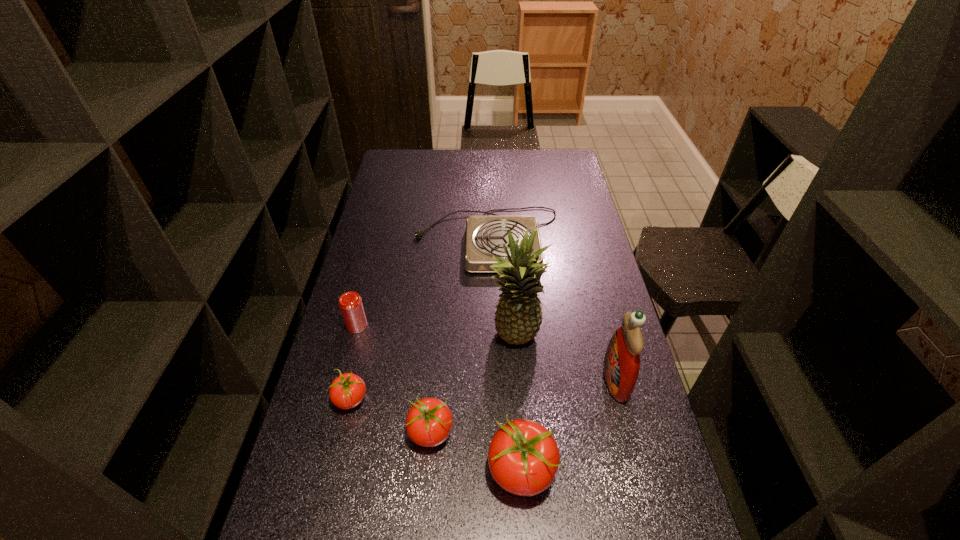
The image size is (960, 540). Find the location of `the shortest tomato`. the shortest tomato is located at coordinates (347, 391).

Image resolution: width=960 pixels, height=540 pixels. I want to click on the leftmost tomato, so click(347, 391).

I want to click on the second shortest tomato, so click(x=429, y=421).

Where is `the tallest tomato`? The image size is (960, 540). the tallest tomato is located at coordinates (523, 457).

This screenshot has width=960, height=540. I want to click on the rightmost tomato, so click(x=523, y=457).

Find the location of a particular element. The height and width of the screenshot is (540, 960). the rightmost object is located at coordinates (621, 364).

I want to click on the second tallest object, so click(x=621, y=364).

What are the coordinates of `the shortest object` in the screenshot? It's located at (485, 235).

The width and height of the screenshot is (960, 540). Identify the location of the farthest object. (485, 235).

Image resolution: width=960 pixels, height=540 pixels. I want to click on the tallest object, so click(x=518, y=317).